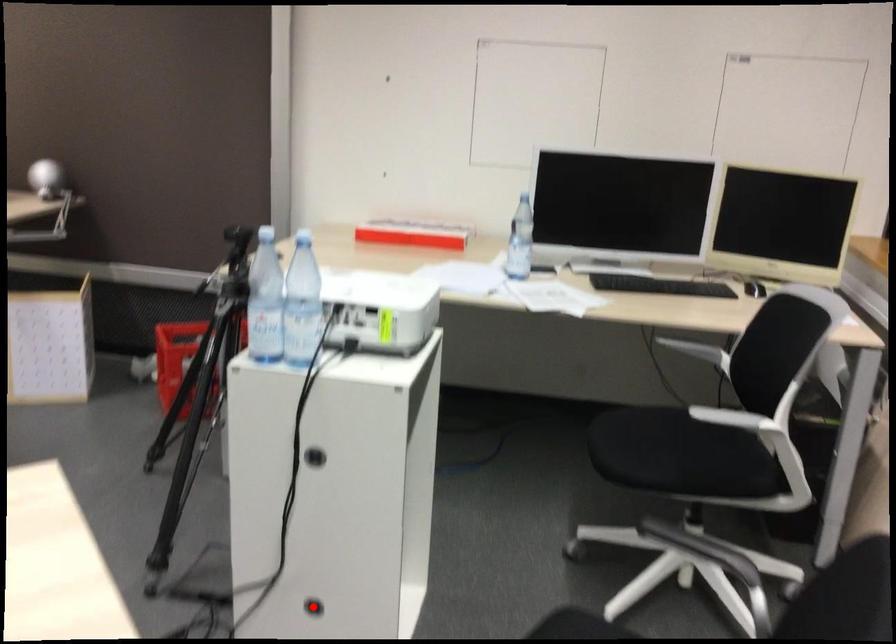
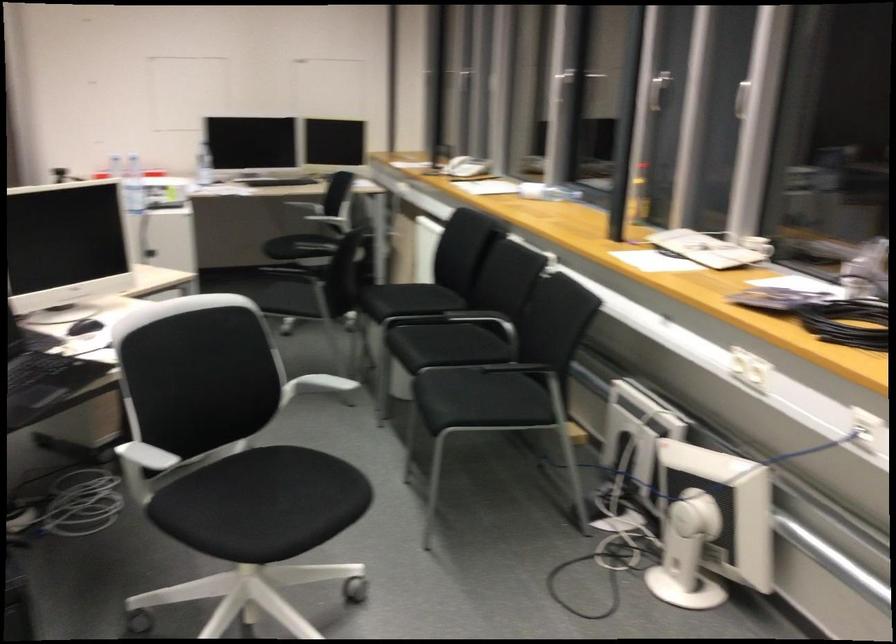
Question: I am providing you with two images of the same scene from different viewpoints. A red point is marked on the first image. Is the red point's position out of view in image 2?

Choices:
 (A) Yes
 (B) No

Answer: (A)